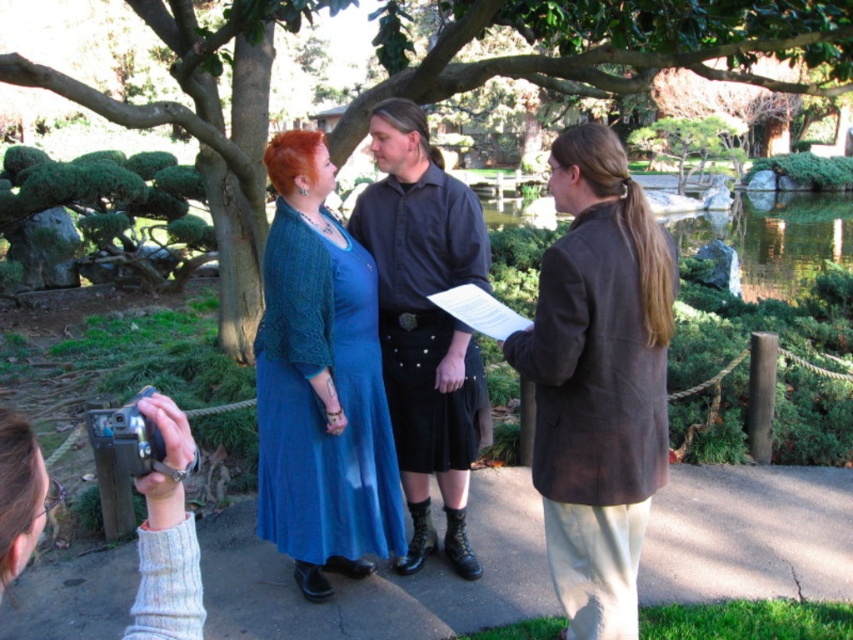
You are a photographer positioned at the front of the scene. You want to take a photo of the brown suede jacket at right without the green leafy tree at center blocking it. What should you do?

Move to the right side of the green leafy tree at center so that the brown suede jacket at right becomes visible without obstruction from the tree.

You are a photographer trying to capture a group photo of the brown suede jacket at right and the black matte shirt at center. Based on their heights, which one should you position closer to the camera to make them appear balanced in the frame?

The brown suede jacket at right is not as tall as the black matte shirt at center, so you should position the brown suede jacket at right closer to the camera to balance their sizes in the photo.

You are standing at the viewpoint of the image and want to know which of the two points, point (618, 605) or point (393, 173), is nearer to you. Which one is closer?

Point (618, 605) is closer to the camera than point (393, 173), so it is nearer to you.